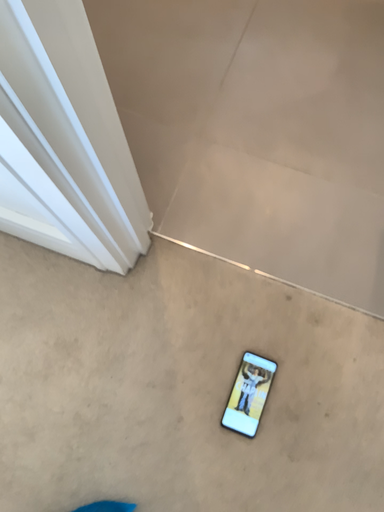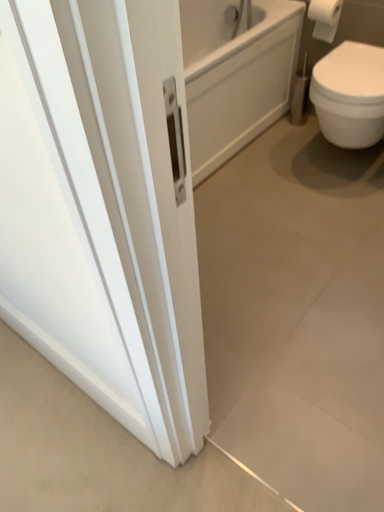
Question: Which way did the camera rotate in the video?

Choices:
 (A) rotated right
 (B) rotated left

Answer: (B)